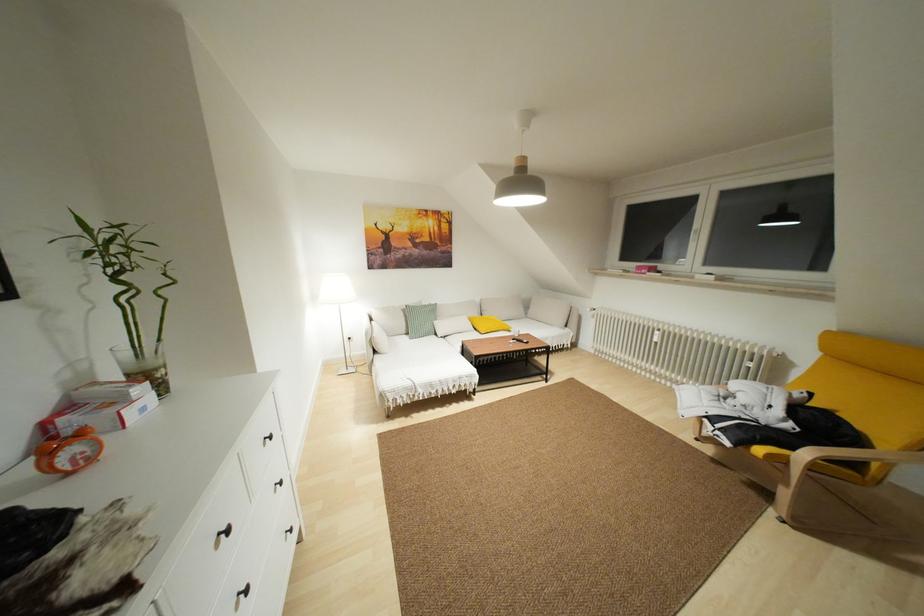
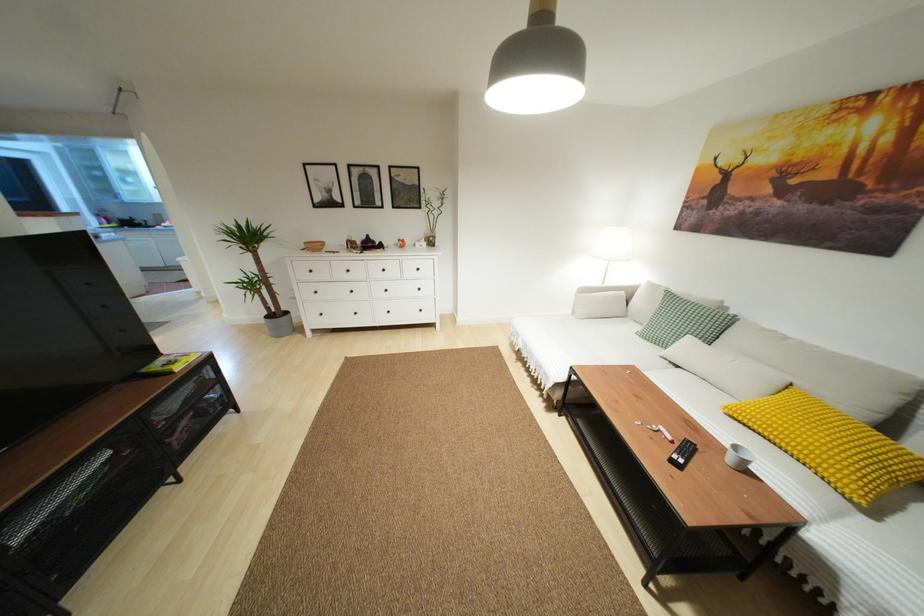
Find the pixel in the second image that matches pixel 226 532 in the first image.

(383, 270)